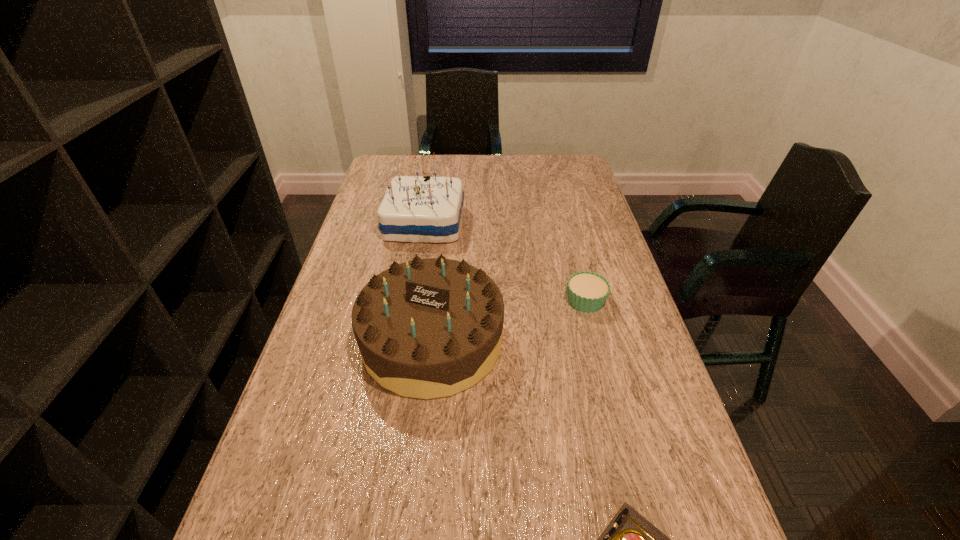
The height and width of the screenshot is (540, 960). In the image, there is a desktop. Identify the location of free space at the right edge. (625, 417).

The width and height of the screenshot is (960, 540). I want to click on vacant space at the far left corner, so click(x=385, y=176).

You are a GUI agent. You are given a task and a screenshot of the screen. Output one action in this format:
    pyautogui.click(x=<x>, y=<y>)
    Task: Click on the vacant space at the far right corner
    The width and height of the screenshot is (960, 540).
    Given the screenshot: What is the action you would take?
    pyautogui.click(x=563, y=161)

At what (x,y) coordinates should I click in order to perform the action: click on free spot between the third tallest object and the farther birthday cake. Please return your answer as a coordinate pair (x, y). The height and width of the screenshot is (540, 960). Looking at the image, I should click on (505, 262).

At what (x,y) coordinates should I click in order to perform the action: click on unoccupied area between the second shortest object and the tallest object. Please return your answer as a coordinate pair (x, y). The width and height of the screenshot is (960, 540). Looking at the image, I should click on (505, 262).

Find the location of a particular element. The image size is (960, 540). free space between the farthest object and the second shortest object is located at coordinates (505, 262).

Identify the location of vacant space in between the third tallest object and the farthest object. (505, 262).

Identify the location of the closest object to the diary. 428,328.

Find the location of a particular element. This screenshot has width=960, height=540. object that stands as the third closest to the cupcake is located at coordinates (630, 539).